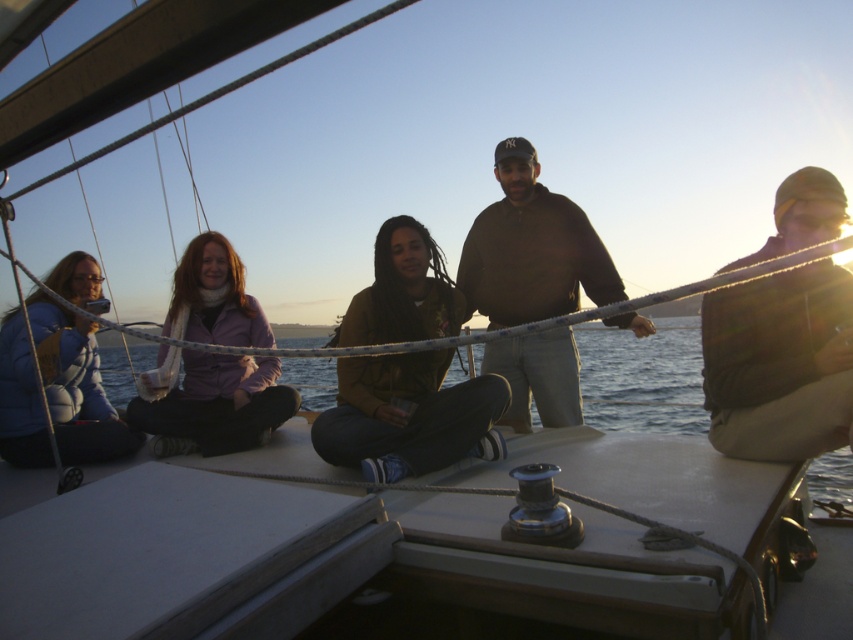
Question: Based on their relative distances, which object is farther from the brown hoodie at center?

Choices:
 (A) brown matte jacket at center
 (B) clear blue water at center
 (C) matte blue jacket at left
 (D) matte purple sweater at center

Answer: (C)

Question: Estimate the real-world distances between objects in this image. Which object is closer to the clear blue water at center?

Choices:
 (A) brown hoodie at center
 (B) matte blue jacket at left
 (C) brown matte jacket at center
 (D) matte purple sweater at center

Answer: (A)

Question: Where is matte purple sweater at center located in relation to clear blue water at center in the image?

Choices:
 (A) right
 (B) left

Answer: (B)

Question: Is clear blue water at center positioned behind matte blue jacket at left?

Choices:
 (A) yes
 (B) no

Answer: (B)

Question: Can you confirm if brown matte jacket at center is smaller than brown hoodie at center?

Choices:
 (A) no
 (B) yes

Answer: (B)

Question: Estimate the real-world distances between objects in this image. Which object is farther from the clear blue water at center?

Choices:
 (A) matte purple sweater at center
 (B) matte blue jacket at left
 (C) brown hoodie at center

Answer: (B)